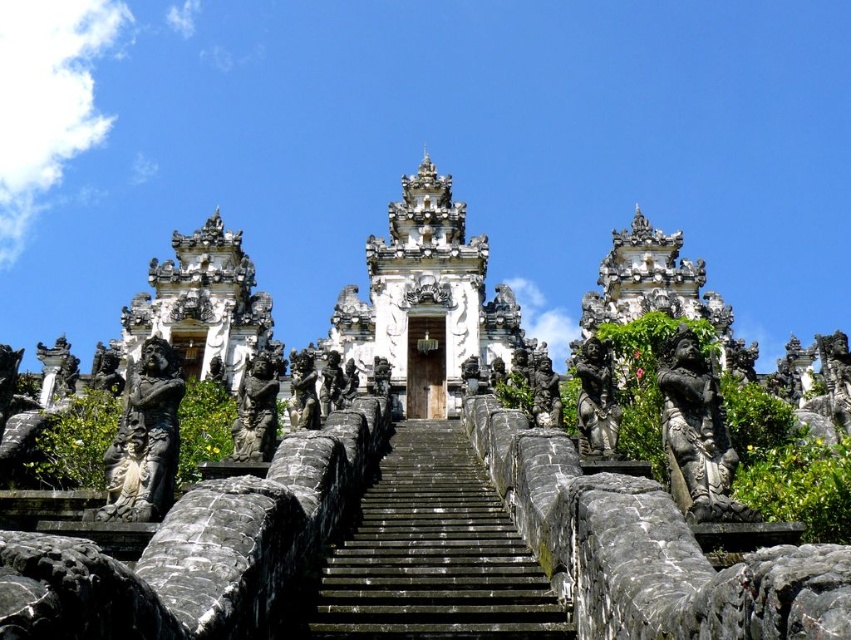
Question: Which point appears farthest from the camera in this image?

Choices:
 (A) (513, 342)
 (B) (415, 438)

Answer: (A)

Question: Does black stone stairs at center have a smaller size compared to white stone temple at center?

Choices:
 (A) yes
 (B) no

Answer: (A)

Question: Among these objects, which one is farthest from the camera?

Choices:
 (A) white stone temple at center
 (B) black stone stairs at center

Answer: (A)

Question: Does black stone stairs at center have a larger size compared to white stone temple at center?

Choices:
 (A) no
 (B) yes

Answer: (A)

Question: Can you confirm if black stone stairs at center is wider than white stone temple at center?

Choices:
 (A) yes
 (B) no

Answer: (B)